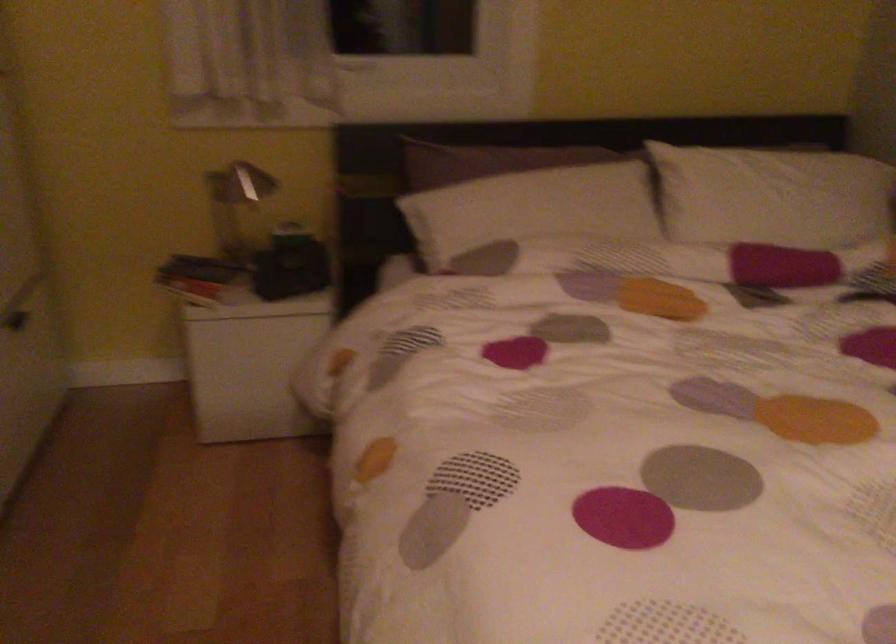
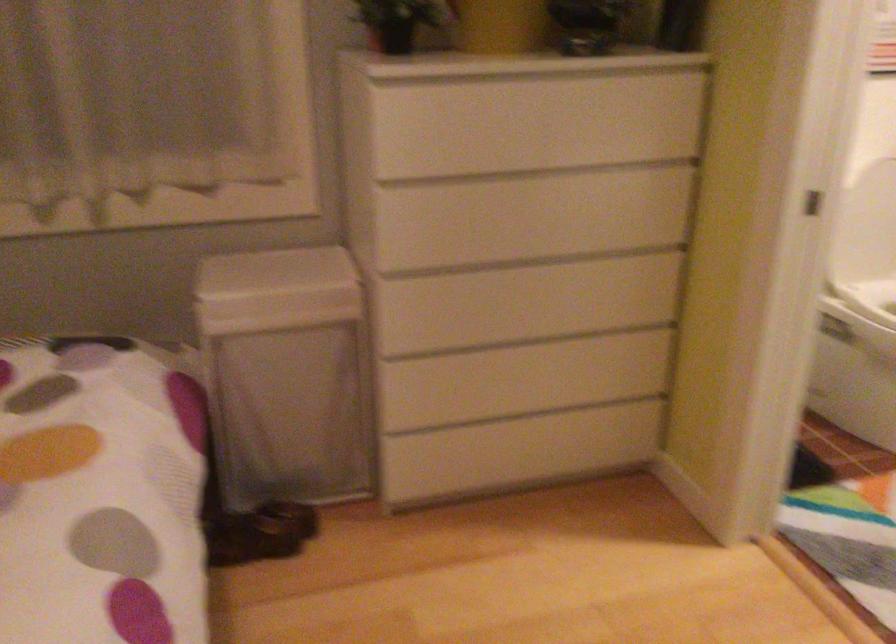
How did the camera likely rotate?

The camera rotated toward right-down.